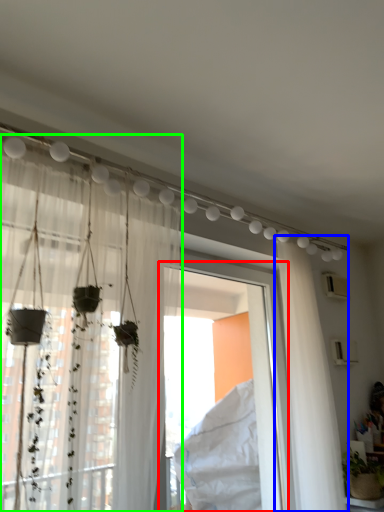
Question: Estimate the real-world distances between objects in this image. Which object is farther from window frame (highlighted by a red box), curtain (highlighted by a blue box) or curtain (highlighted by a green box)?

Choices:
 (A) curtain
 (B) curtain

Answer: (B)